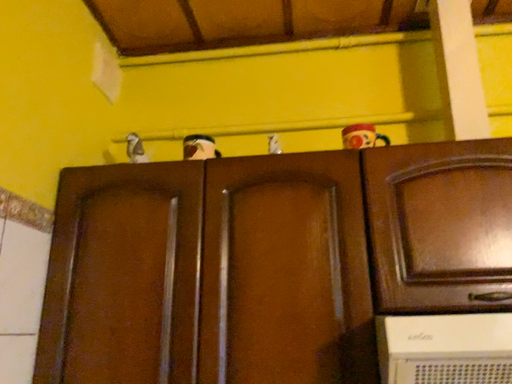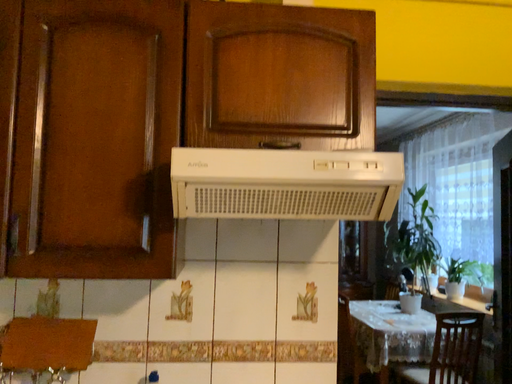
Question: How did the camera likely rotate when shooting the video?

Choices:
 (A) rotated upward
 (B) rotated downward

Answer: (B)